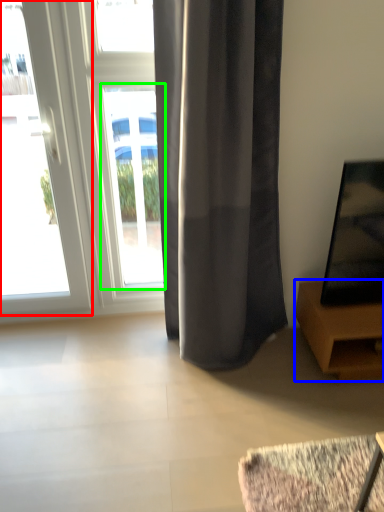
Question: Which is nearer to the door (highlighted by a red box)? furniture (highlighted by a blue box) or window (highlighted by a green box).

Choices:
 (A) furniture
 (B) window

Answer: (B)